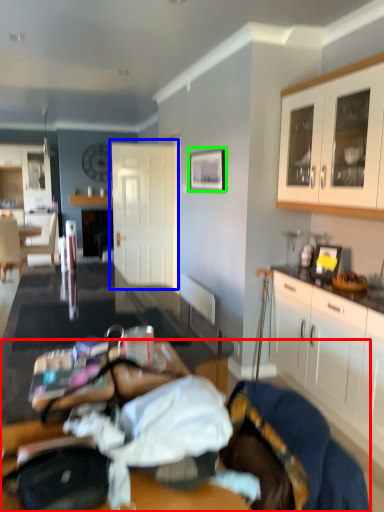
Question: Which object is positioned closest to bed (highlighted by a red box)? Select from door (highlighted by a blue box) and picture frame (highlighted by a green box).

Choices:
 (A) door
 (B) picture frame

Answer: (B)